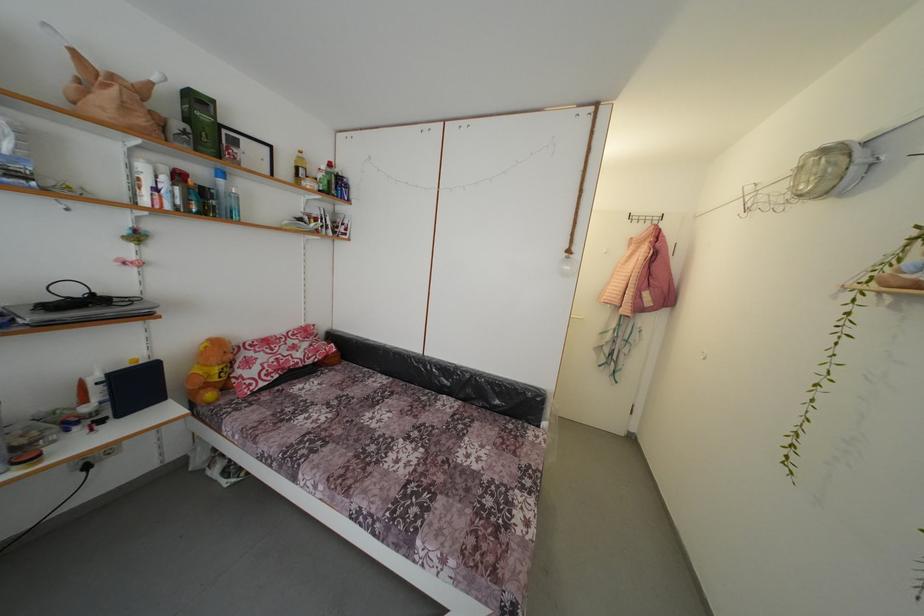
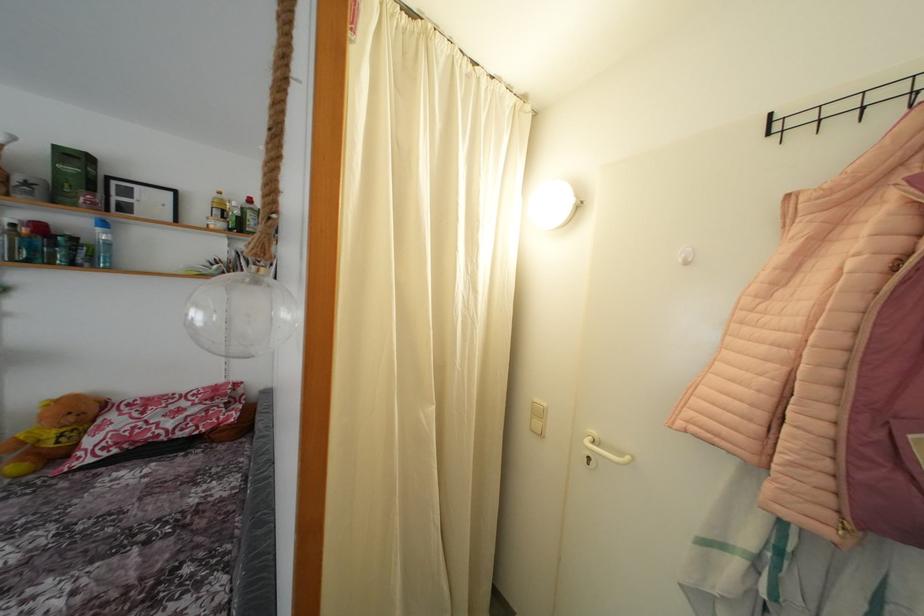
Where in the second image is the point corresponding to (x=306, y=158) from the first image?

(225, 199)